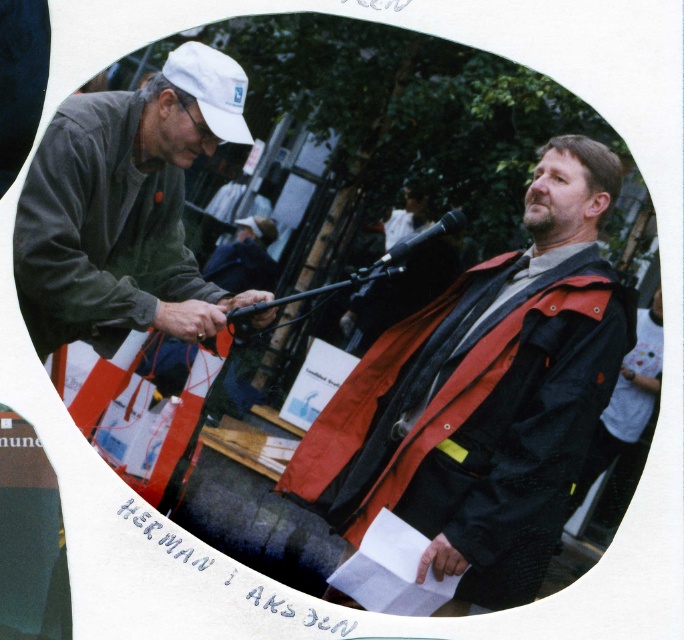
Looking at this image, can you confirm if orange fabric jacket at center is smaller than smooth skin hand at lower center?

Actually, orange fabric jacket at center might be larger than smooth skin hand at lower center.

Between orange fabric jacket at center and smooth skin hand at lower center, which one has less height?

smooth skin hand at lower center is shorter.

Is point (562, 225) less distant than point (462, 560)?

No, it is not.

Identify the location of orange fabric jacket at center. (486, 394).

Does point (92, 344) come farther from viewer compared to point (633, 372)?

Yes, it is behind point (633, 372).

Is point (127, 116) farther from camera compared to point (629, 394)?

Yes, point (127, 116) is behind point (629, 394).

I want to click on matte gray sweater at left, so click(120, 202).

Does orange fabric vest at right appear on the left side of smooth skin hand at lower center?

No, orange fabric vest at right is not to the left of smooth skin hand at lower center.

Between orange fabric vest at right and smooth skin hand at lower center, which one is positioned higher?

orange fabric vest at right is higher up.

Who is more forward, (653, 356) or (419, 579)?

Point (653, 356) is more forward.

The width and height of the screenshot is (684, 640). Identify the location of orange fabric vest at right. (624, 401).